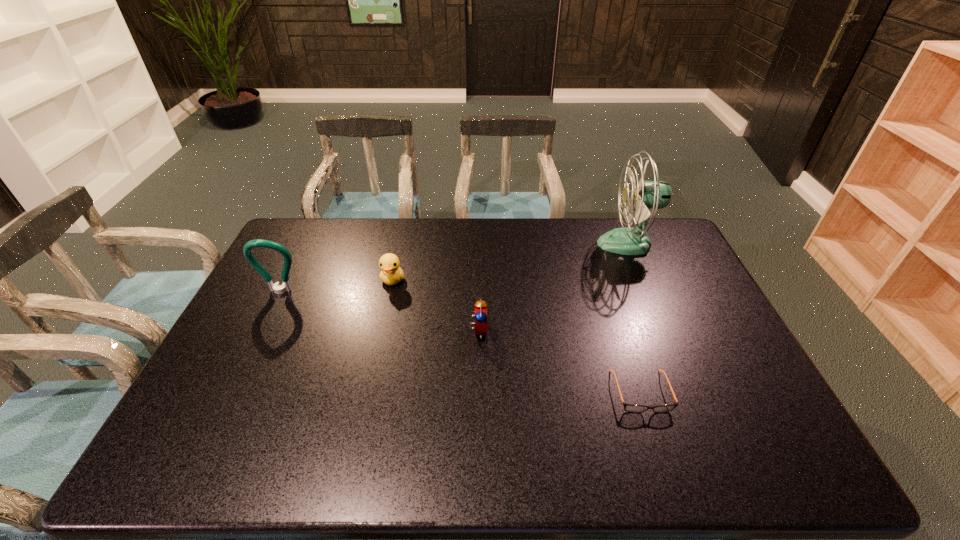
The image size is (960, 540). I want to click on fan, so click(x=647, y=195).

The width and height of the screenshot is (960, 540). Find the location of `the tallest object`. the tallest object is located at coordinates coord(647,195).

Where is `bottle opener`? The image size is (960, 540). bottle opener is located at coordinates (277, 288).

At what (x,y) coordinates should I click in order to perform the action: click on the fourth shortest object. Please return your answer as a coordinate pair (x, y). This screenshot has height=540, width=960. Looking at the image, I should click on (277, 288).

Where is `the third object from right to left`? The image size is (960, 540). the third object from right to left is located at coordinates (480, 311).

This screenshot has width=960, height=540. I want to click on alarm clock, so click(480, 311).

Where is `the fourth object from right to left`? This screenshot has width=960, height=540. the fourth object from right to left is located at coordinates (391, 274).

You are a GUI agent. You are given a task and a screenshot of the screen. Output one action in this format:
    pyautogui.click(x=<x>, y=<y>)
    Task: Click on the shortest object
    The height and width of the screenshot is (540, 960).
    Given the screenshot: What is the action you would take?
    pyautogui.click(x=631, y=408)

The height and width of the screenshot is (540, 960). In order to click on the nearest object in this screenshot , I will do `click(631, 408)`.

Locate an element on the screen. Image resolution: width=960 pixels, height=540 pixels. free space located 0.060m in front of the fan, directing airflow is located at coordinates (581, 244).